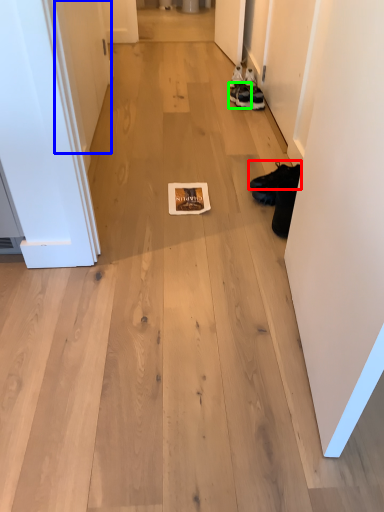
Question: Which is nearer to the footwear (highlighted by a red box)? door (highlighted by a blue box) or footwear (highlighted by a green box).

Choices:
 (A) door
 (B) footwear

Answer: (B)